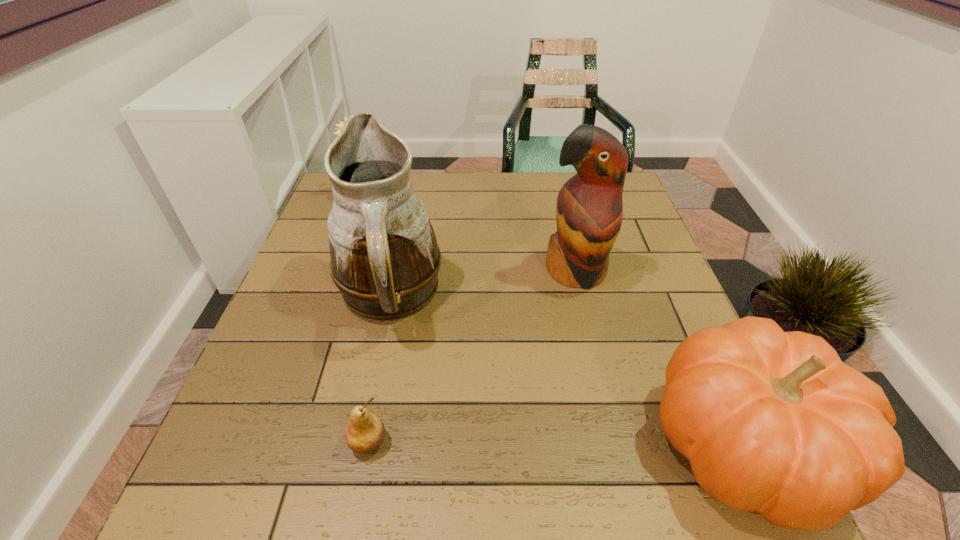
Locate an element on the screen. vacant region located from the spout of the pitcher is located at coordinates (578, 443).

Where is `free region located on the face of the parrot`? free region located on the face of the parrot is located at coordinates (582, 395).

You are a GUI agent. You are given a task and a screenshot of the screen. Output one action in this format:
    pyautogui.click(x=<x>, y=<y>)
    Task: Click on the free region located 0.090m on the face of the parrot
    The height and width of the screenshot is (540, 960).
    Given the screenshot: What is the action you would take?
    pyautogui.click(x=578, y=327)

Locate an element on the screen. vacant area situated 0.300m on the face of the parrot is located at coordinates (583, 414).

Image resolution: width=960 pixels, height=540 pixels. I want to click on object that is at the far edge, so click(x=341, y=124).

I want to click on object situated at the near edge, so click(x=365, y=431).

Where is `sunflower present at the left edge`? sunflower present at the left edge is located at coordinates pos(341,124).

Locate an element on the screen. pitcher located at the left edge is located at coordinates (385, 259).

Find the location of `object present at the right edge`. object present at the right edge is located at coordinates (589, 209).

Find the location of a particular element. This screenshot has width=960, height=540. object that is positioned at the far left corner is located at coordinates (341, 124).